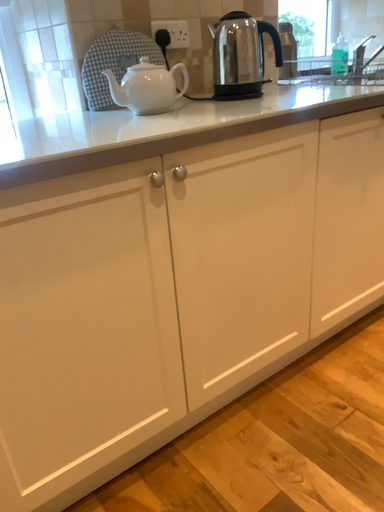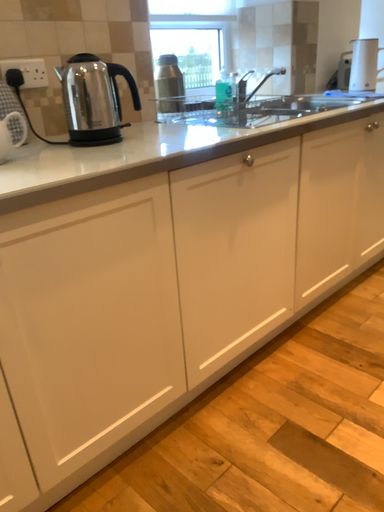
Question: How did the camera likely rotate when shooting the video?

Choices:
 (A) rotated left
 (B) rotated right

Answer: (B)